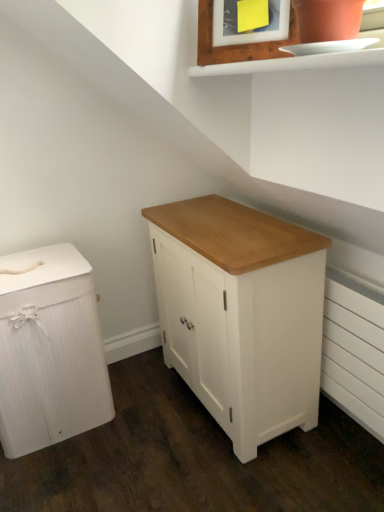
At what (x,y) coordinates should I click in order to perform the action: click on free space on the front side of white painted radiator at lower right. Please return your answer as a coordinate pair (x, y). The width and height of the screenshot is (384, 512). Looking at the image, I should click on (342, 478).